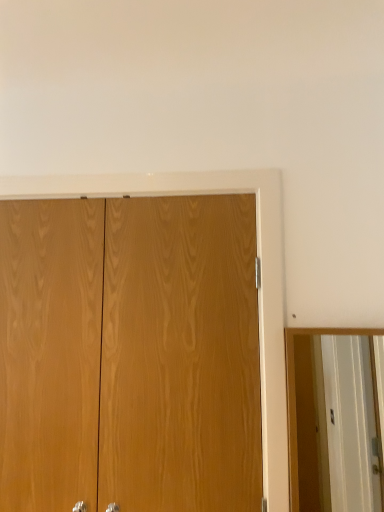
At what (x,y) coordinates should I click in order to perform the action: click on free point above wooden door at center (from a real-world perspective). Please return your answer as a coordinate pair (x, y). Looking at the image, I should click on (133, 169).